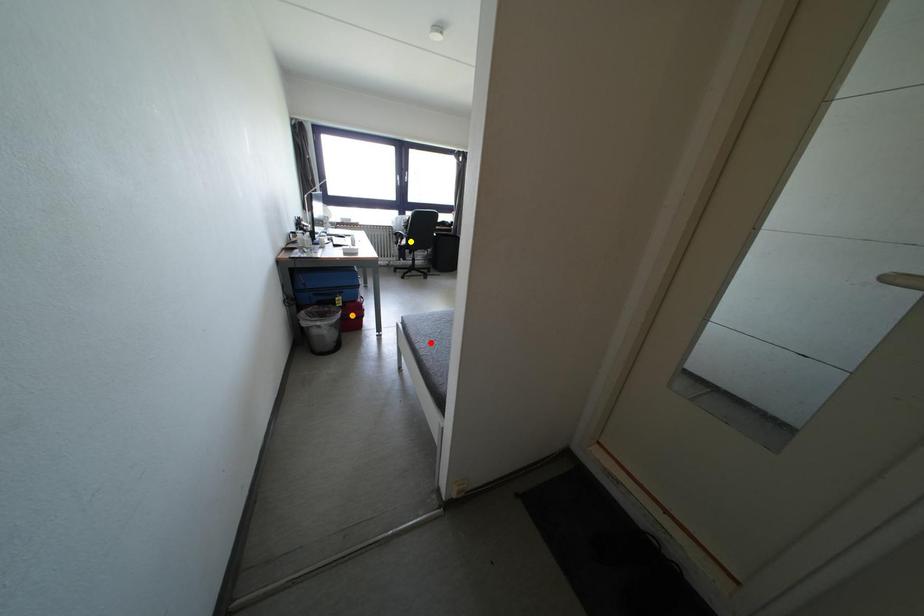
Order these from farthest to nearest:
yellow point | orange point | red point

yellow point
orange point
red point